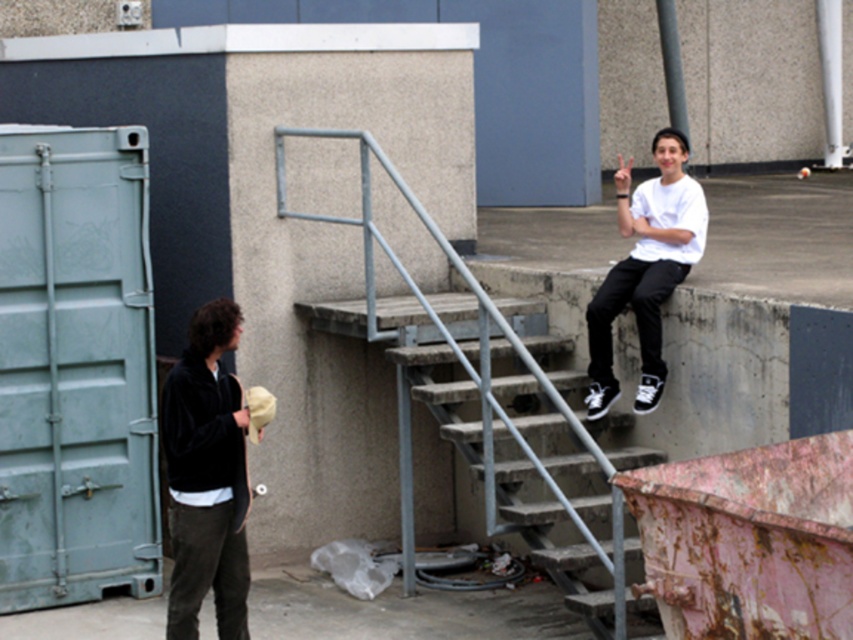
Can you confirm if black velvet jacket at left is smaller than white matte shirt at upper right?

Yes, black velvet jacket at left is smaller than white matte shirt at upper right.

Is black velvet jacket at left bigger than white matte shirt at upper right?

Actually, black velvet jacket at left might be smaller than white matte shirt at upper right.

Identify the location of black velvet jacket at left. The height and width of the screenshot is (640, 853). (206, 476).

Find the location of a particular element. The width and height of the screenshot is (853, 640). black velvet jacket at left is located at coordinates (206, 476).